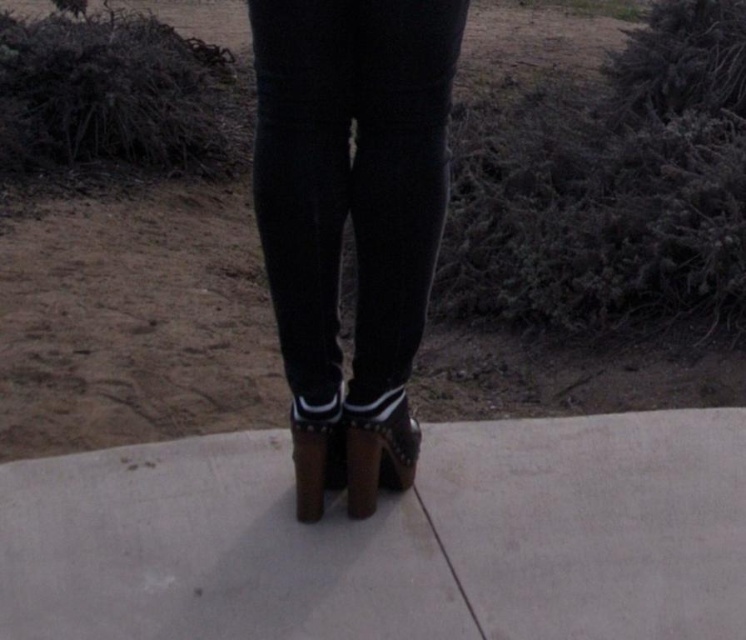
Question: Which point is closer to the camera?

Choices:
 (A) (363, 480)
 (B) (379, 51)
 (C) (307, 438)

Answer: (B)

Question: Where is black matte leggings at center located in relation to leather high-heeled sandal at center in the image?

Choices:
 (A) left
 (B) right

Answer: (A)

Question: Which point is closer to the camera taking this photo?

Choices:
 (A) (379, 396)
 (B) (295, 420)
 (C) (330, 262)

Answer: (C)

Question: From the image, what is the correct spatial relationship of black matte leggings at center in relation to leather high-heeled sandal at center?

Choices:
 (A) below
 (B) above

Answer: (B)

Question: Is black matte leggings at center above leather high-heeled sandal at center?

Choices:
 (A) yes
 (B) no

Answer: (A)

Question: Which is nearer to the brown leather sandal at center?

Choices:
 (A) black matte leggings at center
 (B) leather high-heeled sandal at center

Answer: (B)